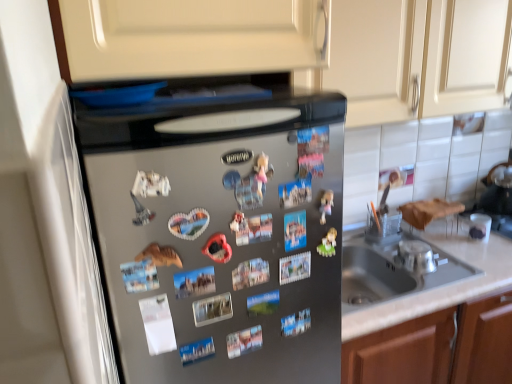
The height and width of the screenshot is (384, 512). What do you see at coordinates (416, 257) in the screenshot? I see `silver metallic bowl at sink` at bounding box center [416, 257].

Image resolution: width=512 pixels, height=384 pixels. I want to click on matte plastic toy at center, so click(x=326, y=205).

Looking at this image, measure the distance between matte cream cabinet at upper center and camera.

1.25 meters.

This screenshot has width=512, height=384. I want to click on silver metallic bowl at sink, so click(x=416, y=257).

Considering the relative sizes of matte plastic toy at center and matte cream cabinet at upper center in the image provided, is matte plastic toy at center shorter than matte cream cabinet at upper center?

Indeed, matte plastic toy at center has a lesser height compared to matte cream cabinet at upper center.

Is matte plastic toy at center outside of matte cream cabinet at upper center?

Indeed, matte plastic toy at center is completely outside matte cream cabinet at upper center.

Is the surface of matte plastic toy at center in direct contact with matte cream cabinet at upper center?

No, matte plastic toy at center is not next to matte cream cabinet at upper center.

From the picture: From a real-world perspective, between silver metallic bowl at sink and matte plastic toy at center, who is vertically higher?

In real-world perspective, matte plastic toy at center is above.

Is point (417, 248) positioned in front of point (324, 205)?

That is False.

Considering the sizes of objects silver metallic bowl at sink and matte plastic toy at center in the image provided, who is bigger, silver metallic bowl at sink or matte plastic toy at center?

Bigger between the two is silver metallic bowl at sink.

Does silver metallic bowl at sink have a lesser height compared to matte plastic toy at center?

Yes, silver metallic bowl at sink is shorter than matte plastic toy at center.

Consider the image. Looking at the image, does satin silver refrigerator at center seem bigger or smaller compared to silver metallic bowl at sink?

Clearly, satin silver refrigerator at center is larger in size than silver metallic bowl at sink.

From the image's perspective, which object appears higher, satin silver refrigerator at center or silver metallic bowl at sink?

silver metallic bowl at sink, from the image's perspective.

Is satin silver refrigerator at center shorter than silver metallic bowl at sink?

No.

Between matte plastic toy at center and silver metallic bowl at sink, which one is positioned behind?

silver metallic bowl at sink is behind.

In the scene shown: Considering the sizes of matte plastic toy at center and silver metallic bowl at sink in the image, is matte plastic toy at center wider or thinner than silver metallic bowl at sink?

In the image, matte plastic toy at center appears to be more narrow than silver metallic bowl at sink.

Does matte plastic toy at center have a lesser height compared to silver metallic bowl at sink?

In fact, matte plastic toy at center may be taller than silver metallic bowl at sink.

In order to click on appliance located underneath the matte plastic toy at center (from a real-world perspective) in this screenshot , I will do `click(416, 257)`.

Considering the relative sizes of silver metallic bowl at sink and satin silver refrigerator at center in the image provided, is silver metallic bowl at sink shorter than satin silver refrigerator at center?

Yes, silver metallic bowl at sink is shorter than satin silver refrigerator at center.

Based on the photo, could satin silver refrigerator at center be considered to be inside silver metallic bowl at sink?

No.

How distant is silver metallic bowl at sink from satin silver refrigerator at center?

They are 33.42 inches apart.

Which object is positioned more to the left, silver metallic bowl at sink or satin silver refrigerator at center?

Positioned to the left is satin silver refrigerator at center.

Considering the sizes of objects matte cream cabinet at upper center and satin silver refrigerator at center in the image provided, who is smaller, matte cream cabinet at upper center or satin silver refrigerator at center?

Smaller between the two is matte cream cabinet at upper center.

How far apart are matte cream cabinet at upper center and satin silver refrigerator at center?

The distance of matte cream cabinet at upper center from satin silver refrigerator at center is 24.61 inches.

Image resolution: width=512 pixels, height=384 pixels. I want to click on cabinetry that is on the right side of satin silver refrigerator at center, so click(397, 61).

From a real-world perspective, is matte cream cabinet at upper center physically located above or below satin silver refrigerator at center?

From a real-world perspective, matte cream cabinet at upper center is physically above satin silver refrigerator at center.

From the image's perspective, is silver metallic bowl at sink located above or below matte cream cabinet at upper center?

Clearly, from the image's perspective, silver metallic bowl at sink is below matte cream cabinet at upper center.

Is silver metallic bowl at sink to the right of matte cream cabinet at upper center from the viewer's perspective?

No.

Would you say silver metallic bowl at sink is a long distance from matte cream cabinet at upper center?

No.

Where is `toy below the matte cream cabinet at upper center (from a real-world perspective)`? The height and width of the screenshot is (384, 512). toy below the matte cream cabinet at upper center (from a real-world perspective) is located at coordinates (326, 205).

Identify the location of appliance below the matte plastic toy at center (from the image's perspective). tap(416, 257).

From the image, which object appears to be nearer to satin silver refrigerator at center, matte cream cabinet at upper center or silver metallic bowl at sink?

The object closer to satin silver refrigerator at center is matte cream cabinet at upper center.

Considering their positions, is matte cream cabinet at upper center positioned further to silver metallic bowl at sink than satin silver refrigerator at center?

The object further to silver metallic bowl at sink is satin silver refrigerator at center.

Looking at this image, based on their spatial positions, is silver metallic bowl at sink or matte cream cabinet at upper center closer to satin silver refrigerator at center?

Among the two, matte cream cabinet at upper center is located nearer to satin silver refrigerator at center.

Looking at the image, which one is located closer to matte cream cabinet at upper center, satin silver refrigerator at center or matte plastic toy at center?

satin silver refrigerator at center.

Looking at the image, which one is located further to silver metallic bowl at sink, satin silver refrigerator at center or matte plastic toy at center?

Based on the image, satin silver refrigerator at center appears to be further to silver metallic bowl at sink.

Estimate the real-world distances between objects in this image. Which object is closer to matte cream cabinet at upper center, matte plastic toy at center or silver metallic bowl at sink?

silver metallic bowl at sink lies closer to matte cream cabinet at upper center than the other object.

Considering their positions, is matte plastic toy at center positioned closer to silver metallic bowl at sink than matte cream cabinet at upper center?

The object closer to silver metallic bowl at sink is matte cream cabinet at upper center.

Considering their positions, is matte cream cabinet at upper center positioned closer to matte plastic toy at center than satin silver refrigerator at center?

Among the two, satin silver refrigerator at center is located nearer to matte plastic toy at center.

You are a GUI agent. You are given a task and a screenshot of the screen. Output one action in this format:
    pyautogui.click(x=<x>, y=<y>)
    Task: Click on the toy between matte cream cabinet at upper center and silver metallic bowl at sink in the vertical direction
    
    Given the screenshot: What is the action you would take?
    pyautogui.click(x=326, y=205)

The height and width of the screenshot is (384, 512). In order to click on appliance between matte cream cabinet at upper center and satin silver refrigerator at center in the up-down direction in this screenshot , I will do coord(416,257).

The width and height of the screenshot is (512, 384). Identify the location of toy between satin silver refrigerator at center and silver metallic bowl at sink along the z-axis. (326, 205).

The height and width of the screenshot is (384, 512). Identify the location of toy between matte cream cabinet at upper center and satin silver refrigerator at center from top to bottom. (326, 205).